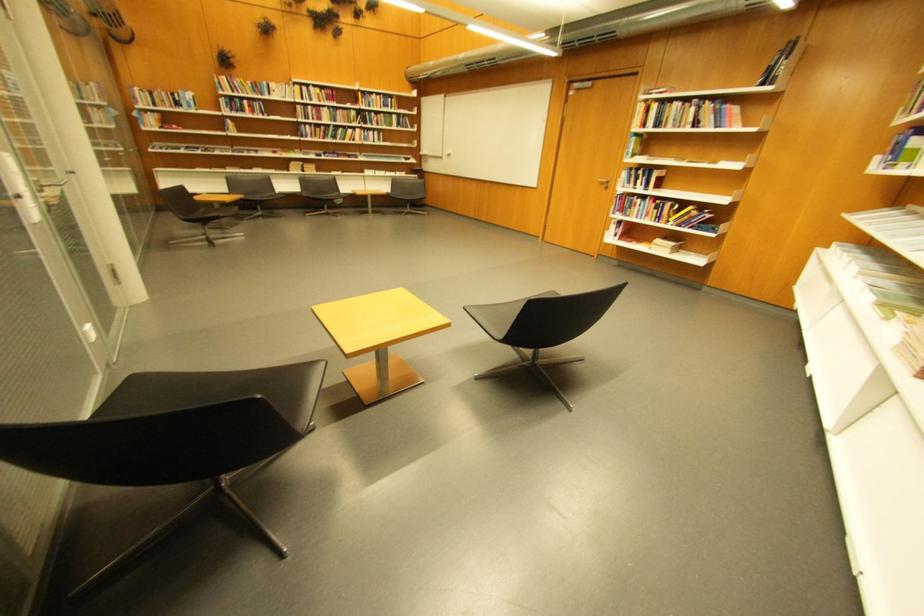
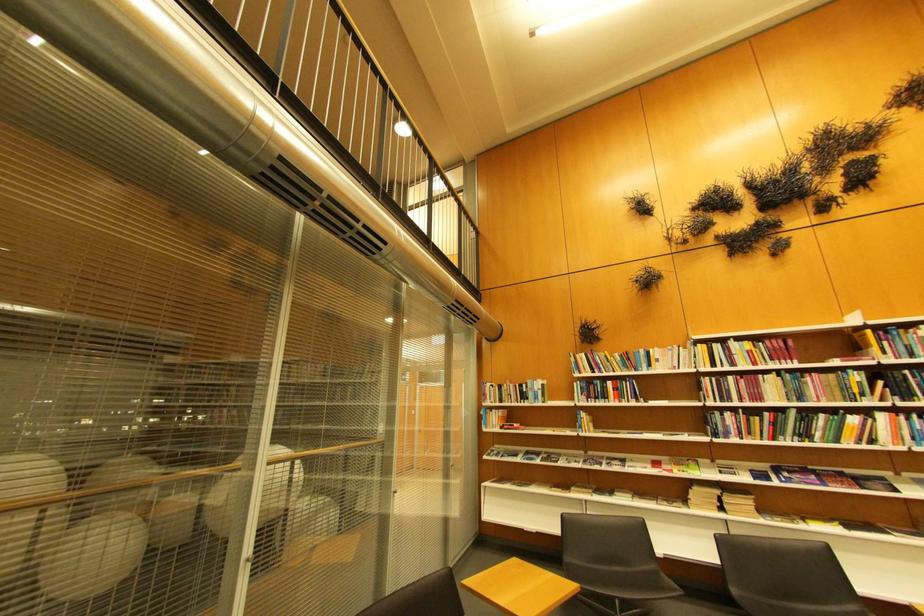
Where in the second image is the point corresponding to point 370,95 from the first image?

(880, 333)